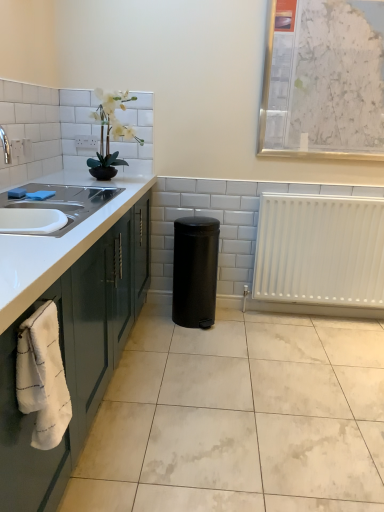
This screenshot has width=384, height=512. Find the location of `vacant space to the left of black matte trash can at center`. vacant space to the left of black matte trash can at center is located at coordinates (155, 324).